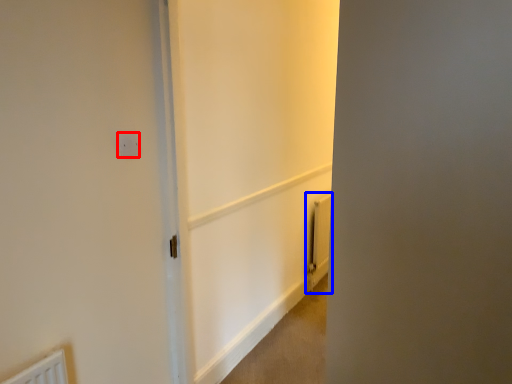
Question: Which object is closer to the camera taking this photo, electric outlet (highlighted by a red box) or radiator (highlighted by a blue box)?

Choices:
 (A) electric outlet
 (B) radiator

Answer: (A)